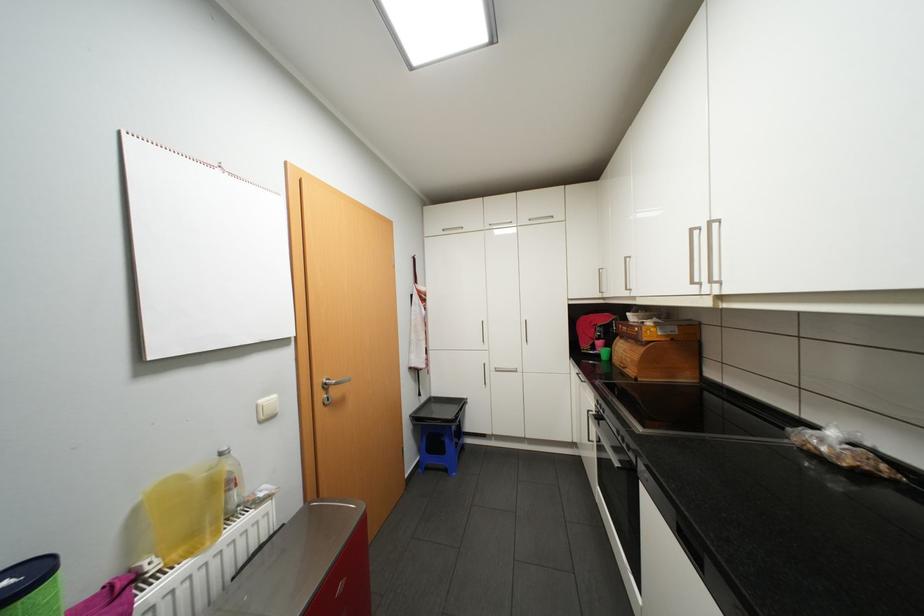
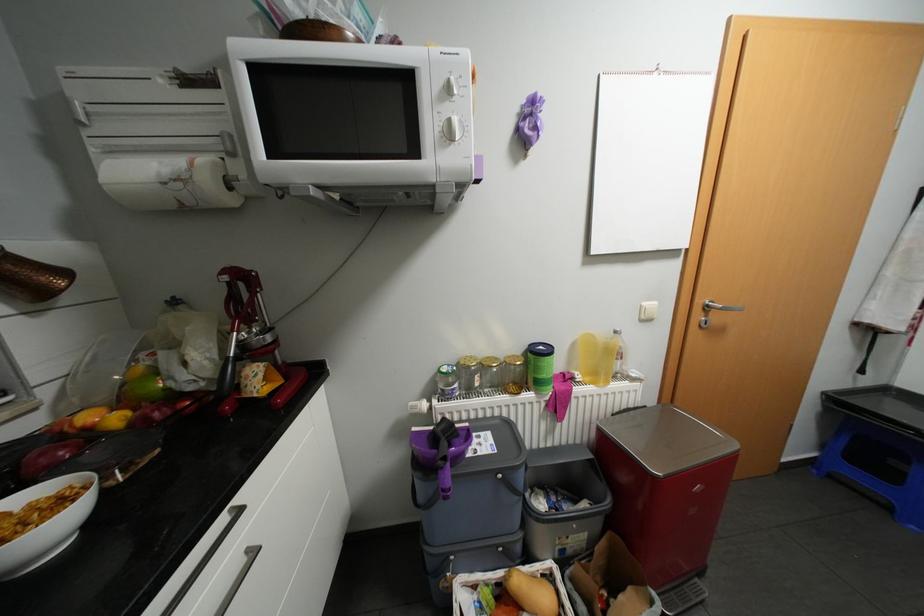
Where in the second image is the point corresponding to [238,517] from the first image?

(622, 377)